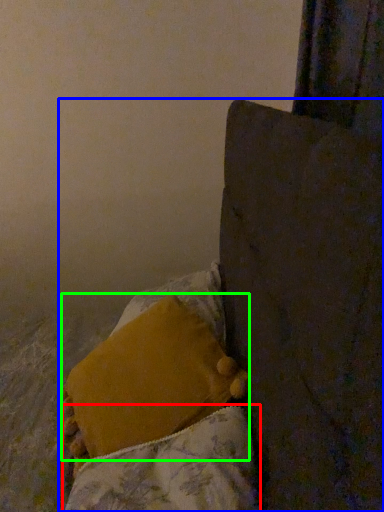
Question: Estimate the real-world distances between objects in this image. Which object is closer to blanket (highlighted by a red box), furniture (highlighted by a blue box) or pillow (highlighted by a green box)?

Choices:
 (A) furniture
 (B) pillow

Answer: (B)